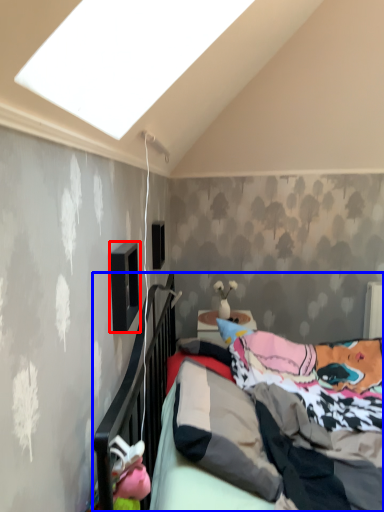
Question: Which point is further to the camera, window (highlighted by a red box) or bed (highlighted by a blue box)?

Choices:
 (A) window
 (B) bed

Answer: (A)